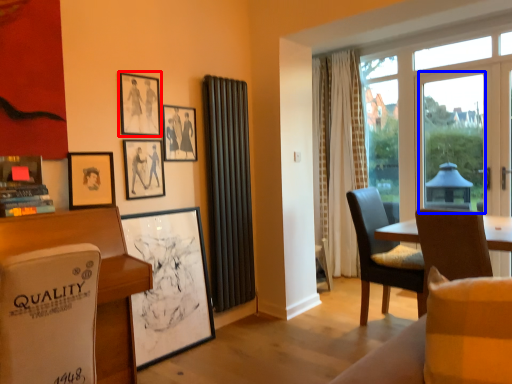
Question: Which object is further to the camera taking this photo, picture frame (highlighted by a red box) or window screen (highlighted by a blue box)?

Choices:
 (A) picture frame
 (B) window screen

Answer: (B)